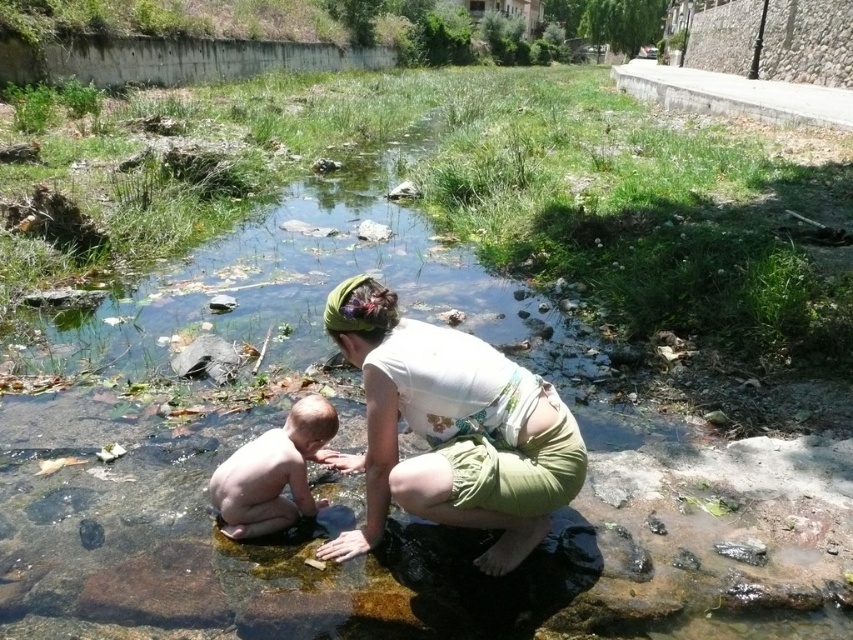
You are a photographer trying to capture a closeup shot of the smooth skin baby at center and the white fabric at center. Since your camera has a fixed focal length, you need to know which object is wider to adjust the focus. Which object has a greater width?

The white fabric at center has a greater width than the smooth skin baby at center according to the description.

You are standing at the edge of the stream and want to place a small pebble at point A and point B. If point A is at coordinates point (399, 321) and point B is at point (264, 532), which point is closer to you?

Point A at point (399, 321) is closer to you than point B at point (264, 532).